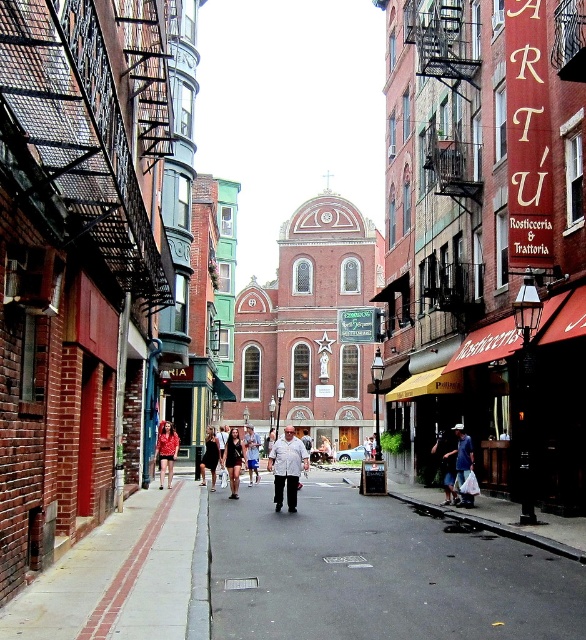
Question: Does black dress at center have a larger size compared to matte black dress at center?

Choices:
 (A) no
 (B) yes

Answer: (B)

Question: Can you confirm if black asphalt at center is smaller than matte black dress at center?

Choices:
 (A) yes
 (B) no

Answer: (B)

Question: Is black asphalt at center bigger than matte black dress at center?

Choices:
 (A) no
 (B) yes

Answer: (B)

Question: Which is nearer to the matte black dress at center?

Choices:
 (A) dark brown leather jacket at center
 (B) black asphalt at center

Answer: (A)

Question: Which object appears farthest from the camera in this image?

Choices:
 (A) dark blue jeans at center
 (B) matte black dress at center
 (C) blue cotton shirt at center
 (D) dark brown leather jacket at center

Answer: (B)

Question: Which point is farther to the camera?

Choices:
 (A) (291, 481)
 (B) (234, 432)
 (C) (322, 456)

Answer: (C)